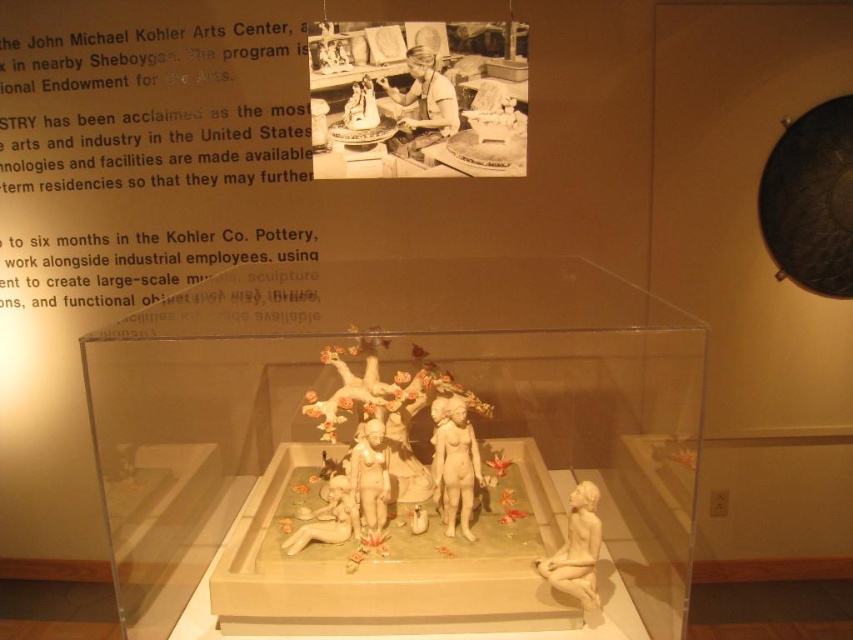
Question: Which object appears closest to the camera in this image?

Choices:
 (A) translucent glass sculpture at center
 (B) matte white statue at lower right
 (C) porcelain cherub at center

Answer: (A)

Question: Which point appears closest to the camera in this image?

Choices:
 (A) (352, 460)
 (B) (149, 609)
 (C) (465, 486)
 (D) (322, 512)

Answer: (B)

Question: Is white porcelain statue at center bigger than porcelain cherub at center?

Choices:
 (A) no
 (B) yes

Answer: (A)

Question: Observing the image, what is the correct spatial positioning of matte white statue at center in reference to white porcelain statue at center?

Choices:
 (A) right
 (B) left

Answer: (A)

Question: Which point is closer to the camera?

Choices:
 (A) (456, 408)
 (B) (253, 284)
 (C) (598, 552)
 (D) (289, 540)

Answer: (C)

Question: Observing the image, what is the correct spatial positioning of translucent glass sculpture at center in reference to porcelain cherub at center?

Choices:
 (A) below
 (B) above

Answer: (B)